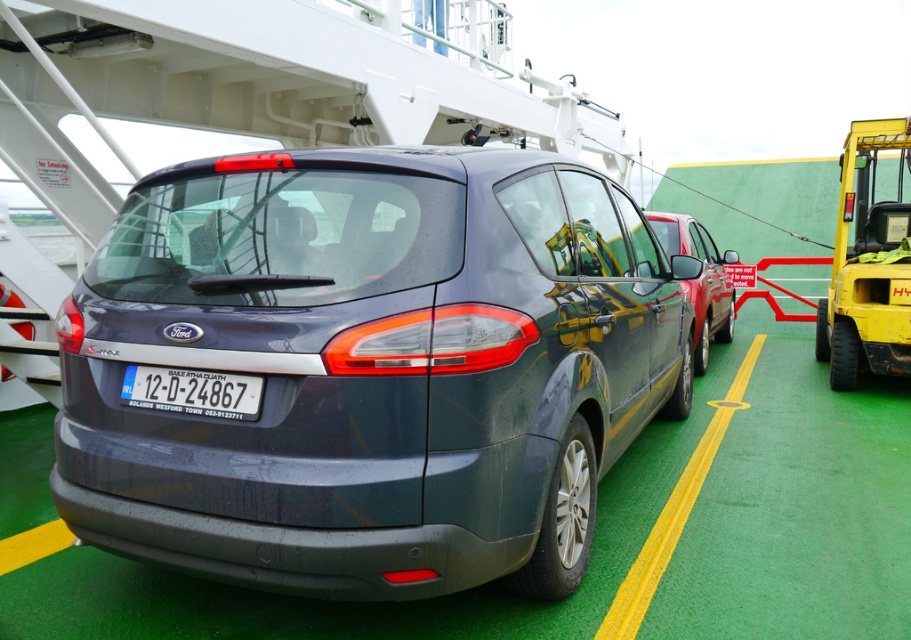
You are a passenger on the ferry and want to take a photo of both the satin dark gray car at center and the metallic red car at center. Which car should you focus on first to ensure both are in the frame?

You should focus on the satin dark gray car at center first since it is closer to you than the metallic red car at center, allowing both to be in the frame by adjusting the camera angle or zoom.

You are a parking attendant on a ferry deck. You need to ensure that all vehicles are parked at least 4 meters apart for safety. There is a satin dark gray car at center and a metallic red car at center. Are these two cars meeting the safety distance requirement?

The satin dark gray car at center and metallic red car at center are 4.19 meters apart, which exceeds the required 4 meters, so they are meeting the safety distance requirement.